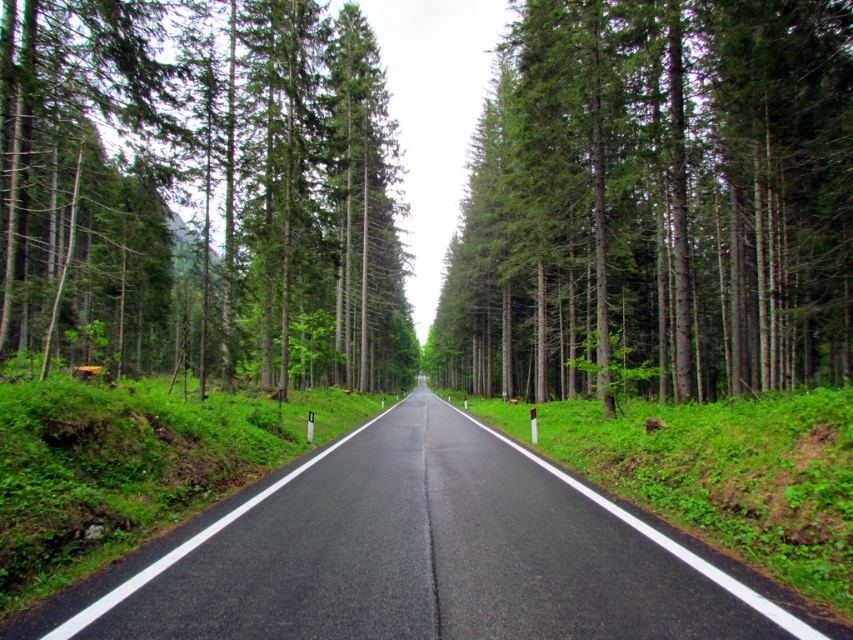
Is point (642, 240) more distant than point (671, 561)?

Yes.

Is point (577, 48) in front of point (653, 582)?

No, (577, 48) is further to viewer.

Find the location of a particular element. green matte tree at center is located at coordinates (657, 202).

Who is more forward, (489,320) or (44,163)?

Positioned in front is point (44,163).

Does green matte tree at center have a lesser width compared to green matte tree at left?

Yes, green matte tree at center is thinner than green matte tree at left.

Is point (535, 77) more distant than point (195, 300)?

No, it is in front of (195, 300).

Find the location of a particular element. This screenshot has width=853, height=640. green matte tree at center is located at coordinates (657, 202).

Where is `green matte tree at left`? Image resolution: width=853 pixels, height=640 pixels. green matte tree at left is located at coordinates (201, 193).

Consider the image. Which is more to the right, green matte tree at left or asphalt road at center?

asphalt road at center is more to the right.

Who is more distant from viewer, (132, 8) or (422, 540)?

Positioned behind is point (132, 8).

This screenshot has height=640, width=853. Identify the location of green matte tree at left. (201, 193).